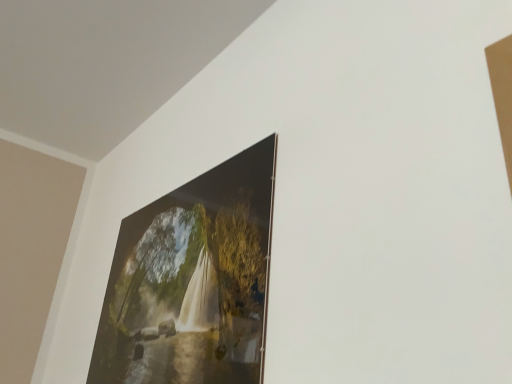
What do you see at coordinates (192, 281) in the screenshot? I see `metallic glossy picture frame at upper center` at bounding box center [192, 281].

Find the location of `metallic glossy picture frame at upper center`. metallic glossy picture frame at upper center is located at coordinates (192, 281).

Locate an element on the screen. Image resolution: width=512 pixels, height=384 pixels. metallic glossy picture frame at upper center is located at coordinates (192, 281).